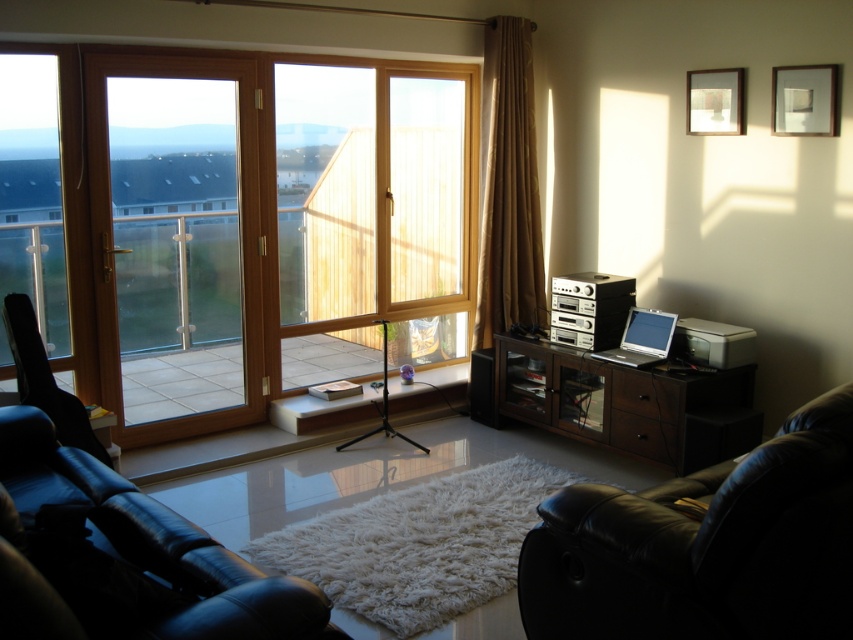
You are a delivery person who needs to place a large package that is 3 meters long in the living room. The package must be placed between the dark wood cabinet at center right and the black leather armchair at left. Is there enough space for the package to fit between them?

The dark wood cabinet at center right is 2.73 meters away from the black leather armchair at left, so the 3 meter long package will not fit between them as the distance is shorter than the package length.

You are planning to place a new piece of furniture in the living room. You have a wide entertainment system that needs to fit between the dark wood cabinet at center right and the transparent glass window at left. Based on the scene description, can the entertainment system be placed between these two objects?

The dark wood cabinet at center right is wider than the transparent glass window at left. Therefore, the entertainment system can be placed between them as there is sufficient space between the two objects.